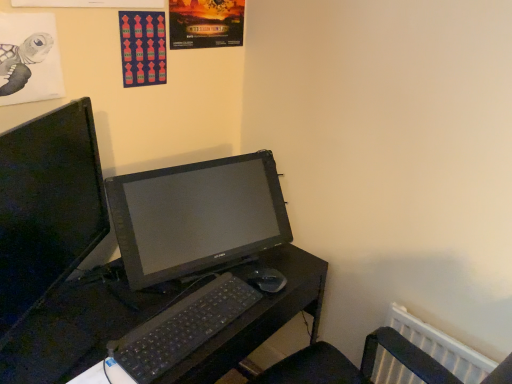
I want to click on free space above black plastic keyboard at center (from a real-world perspective), so point(186,312).